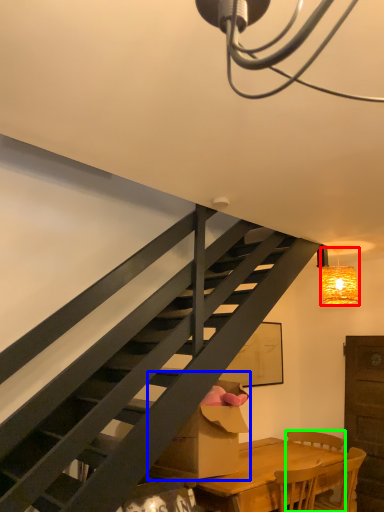
Question: Considering the real-world distances, which object is farthest from lamp (highlighted by a red box)? cardboard box (highlighted by a blue box) or chair (highlighted by a green box)?

Choices:
 (A) cardboard box
 (B) chair

Answer: (A)